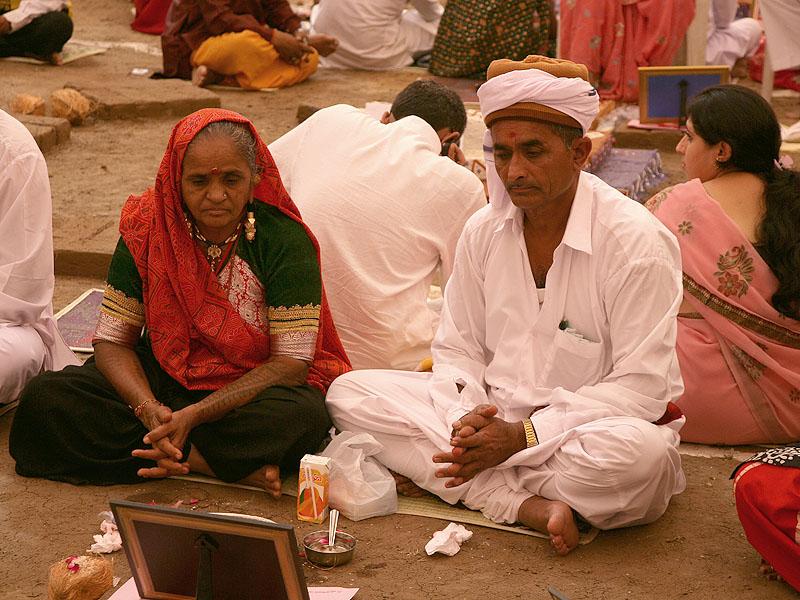
What are the coordinates of `crumbled-up napkins` in the screenshot? It's located at (442, 549), (113, 533).